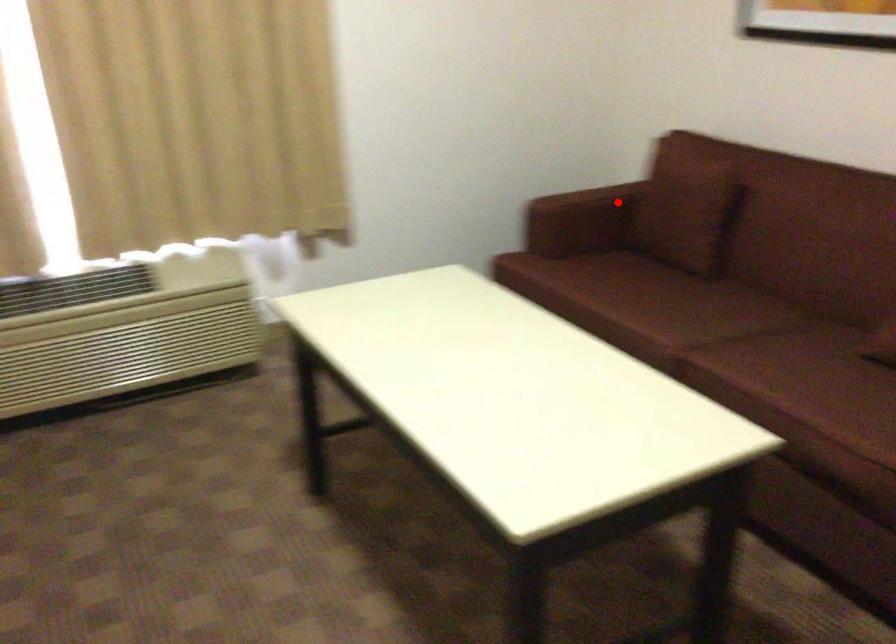
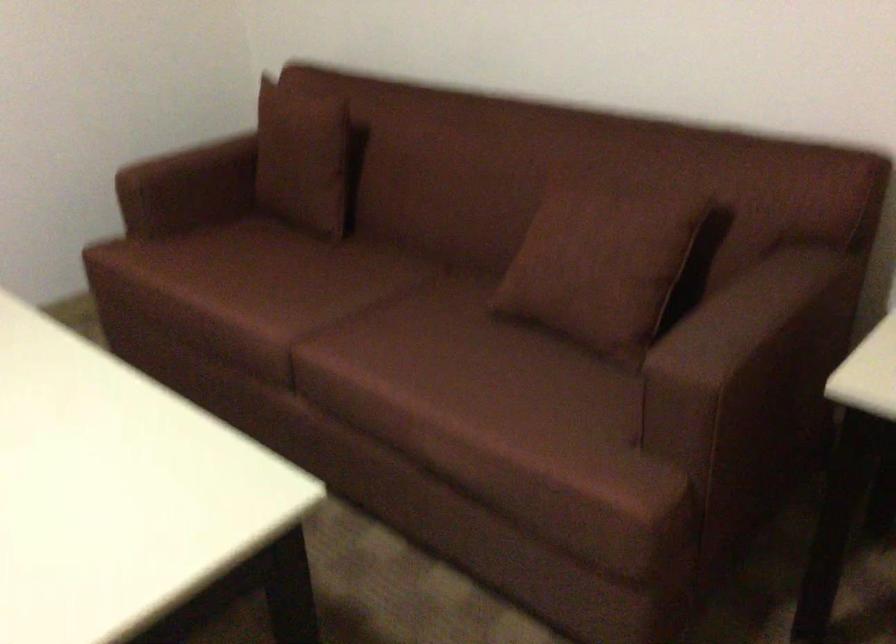
Question: I am providing you with two images of the same scene from different viewpoints. Given a red point in image1, look at the same physical point in image2. Is it:

Choices:
 (A) Closer to the viewpoint
 (B) Farther from the viewpoint

Answer: (A)